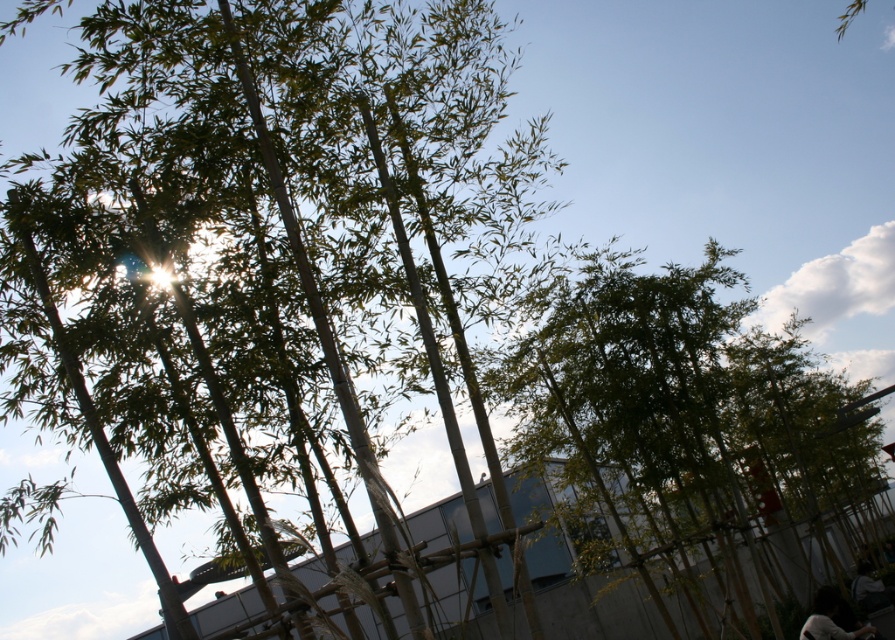
Question: In this image, where is dark hair at lower right located relative to dark gray fabric bag at lower right?

Choices:
 (A) below
 (B) above

Answer: (B)

Question: Can you confirm if green leafy tree at center is positioned to the right of dark gray fabric bag at lower right?

Choices:
 (A) yes
 (B) no

Answer: (B)

Question: Which point is closer to the camera?

Choices:
 (A) (564, 387)
 (B) (819, 589)

Answer: (B)

Question: Which point is closer to the camera?

Choices:
 (A) (650, 556)
 (B) (880, 588)
 (C) (867, 627)

Answer: (C)

Question: Considering the real-world distances, which object is closest to the dark hair at lower right?

Choices:
 (A) dark gray fabric bag at lower right
 (B) green leafy tree at center

Answer: (A)

Question: Can you confirm if green leafy tree at center is smaller than dark hair at lower right?

Choices:
 (A) yes
 (B) no

Answer: (B)